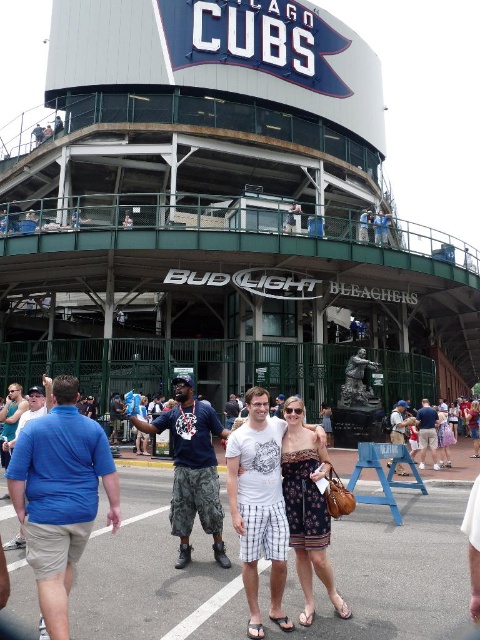
Is patterned fabric dress at center closer to the viewer compared to matte brown statue at center?

Yes, patterned fabric dress at center is in front of matte brown statue at center.

Can you confirm if patterned fabric dress at center is positioned to the left of matte brown statue at center?

Yes, patterned fabric dress at center is to the left of matte brown statue at center.

The height and width of the screenshot is (640, 480). Describe the element at coordinates (308, 506) in the screenshot. I see `patterned fabric dress at center` at that location.

Where is `patterned fabric dress at center`? This screenshot has width=480, height=640. patterned fabric dress at center is located at coordinates (308, 506).